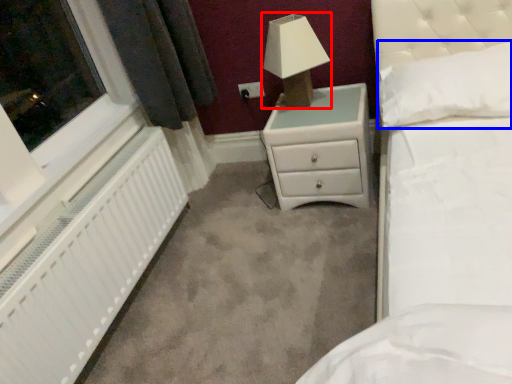
Question: Which of the following is the farthest to the observer, lamp (highlighted by a red box) or pillow (highlighted by a blue box)?

Choices:
 (A) lamp
 (B) pillow

Answer: (A)